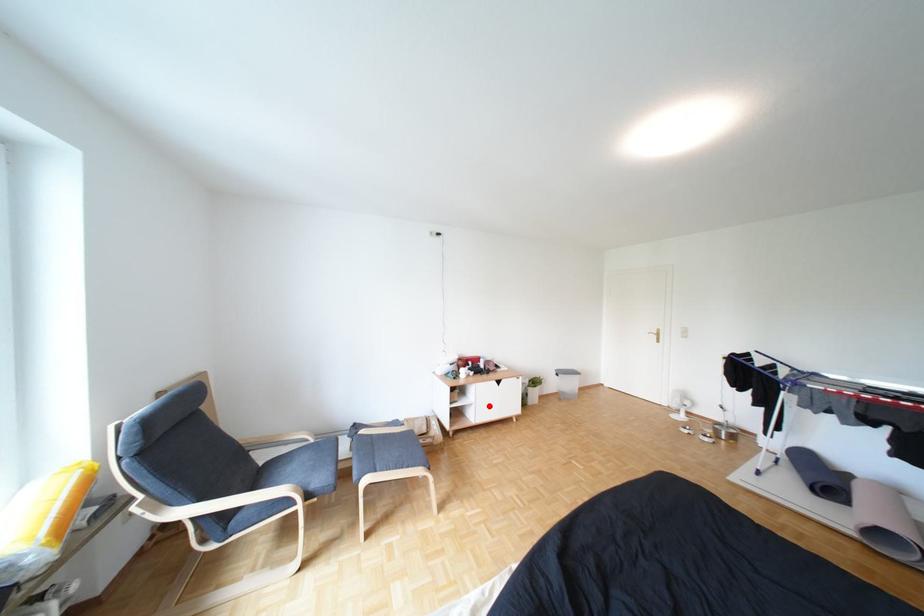
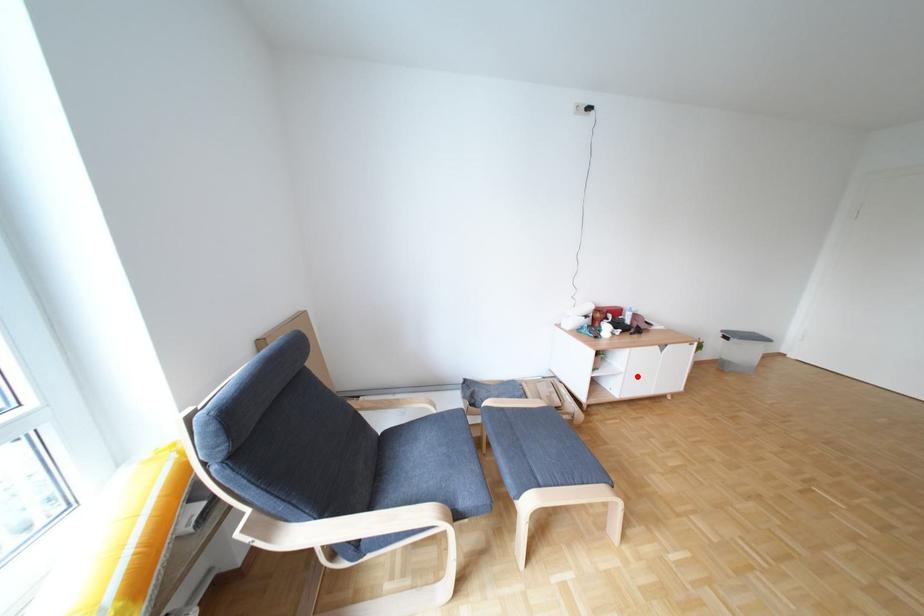
I am providing you with two images of the same scene from different viewpoints. A red point is marked on the first image and another point is marked on the second image. Do the highlighted points in image1 and image2 indicate the same real-world spot?

Yes